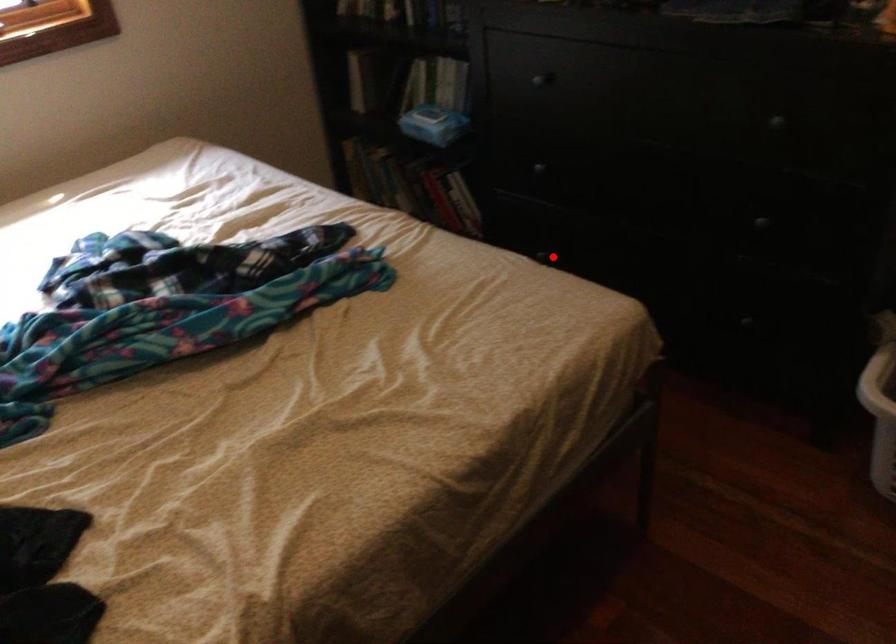
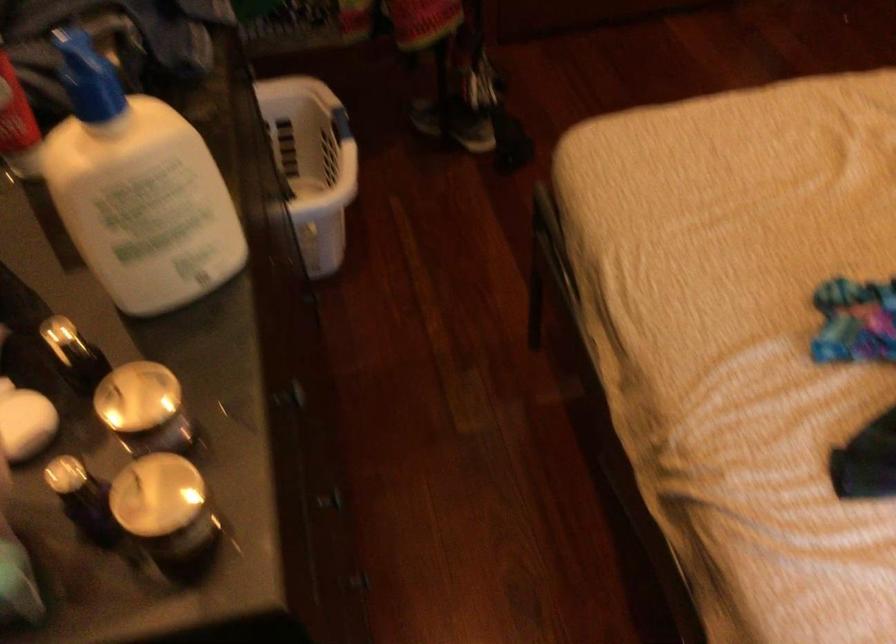
Where in the second image is the point corresponding to the highlighted location from the first image?

(359, 582)